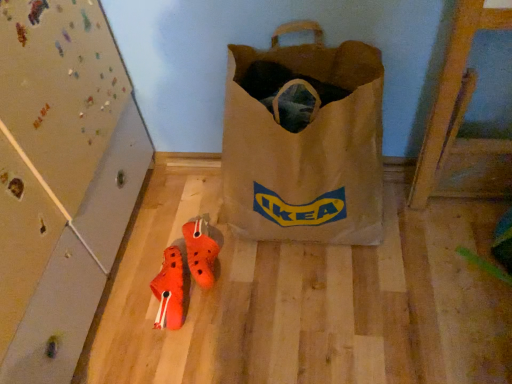
Where is `blank area to the left of orange matte sneakers at lower center, arranged as the first footwear when viewed from the left`? blank area to the left of orange matte sneakers at lower center, arranged as the first footwear when viewed from the left is located at coordinates [122, 312].